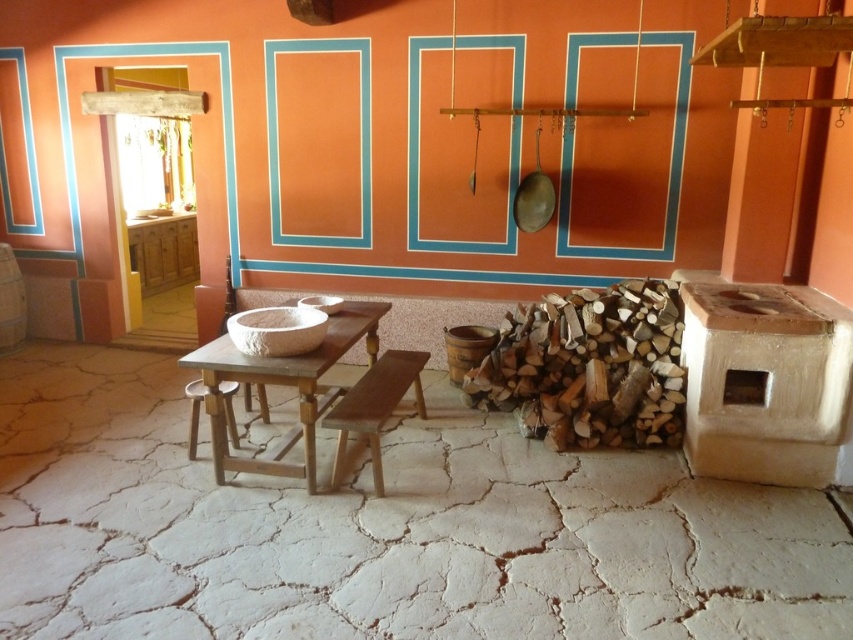
Is point (416, 371) behind point (225, 412)?

Yes, point (416, 371) is farther from viewer.

Between point (347, 406) and point (222, 385), which one is positioned behind?

Positioned behind is point (222, 385).

Does point (410, 378) lie behind point (225, 416)?

Yes, point (410, 378) is farther from viewer.

Locate an element on the screen. The height and width of the screenshot is (640, 853). wooden bench at center is located at coordinates (374, 406).

Is point (315, 396) farther from camera compared to point (364, 417)?

Yes, point (315, 396) is behind point (364, 417).

Is wooden table at center above wooden bench at center?

Indeed, wooden table at center is positioned over wooden bench at center.

Is point (321, 369) in front of point (345, 420)?

Yes, it is.

Locate an element on the screen. wooden table at center is located at coordinates (283, 385).

Is wooden table at center to the right of wooden stool at lower left from the viewer's perspective?

Indeed, wooden table at center is positioned on the right side of wooden stool at lower left.

Between point (283, 472) and point (235, 381), which one is positioned in front?

Point (235, 381)

Between point (221, 342) and point (236, 388), which one is positioned in front?

Point (221, 342) is in front.

Find the location of `wooden table at center`. wooden table at center is located at coordinates (283, 385).